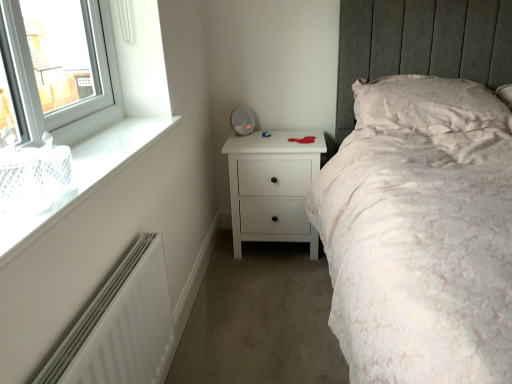
This screenshot has height=384, width=512. I want to click on empty space that is ontop of white matte radiator at lower left, so click(102, 300).